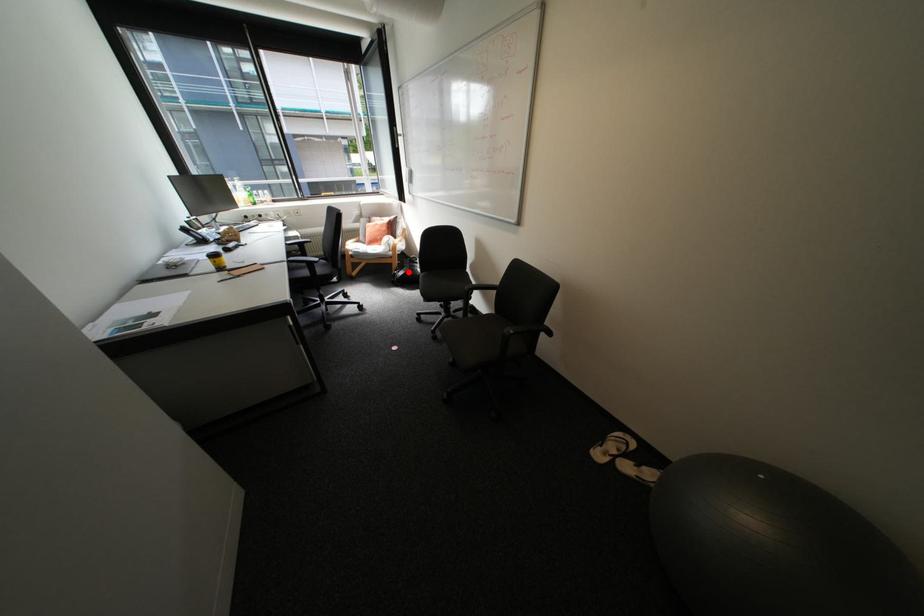
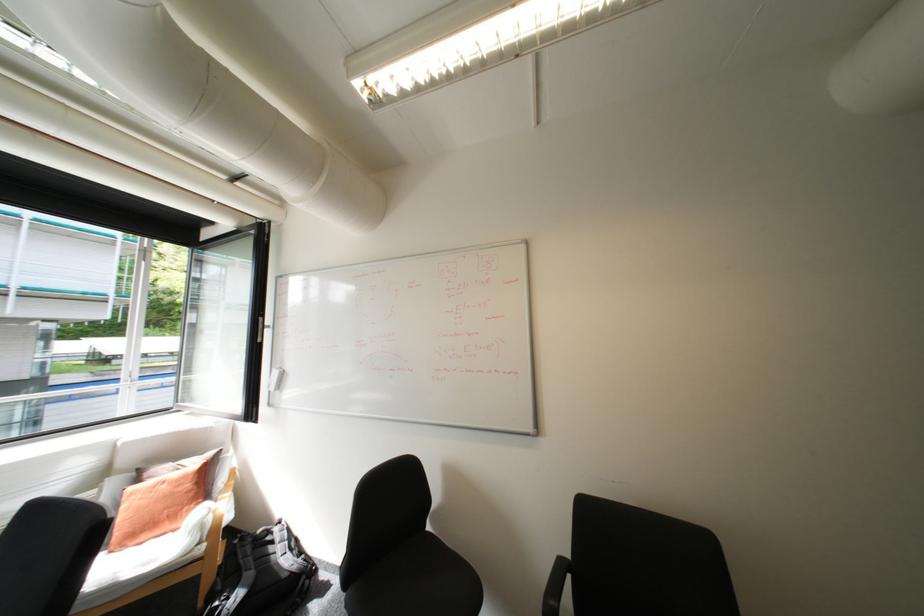
Question: A red point is marked in image1. In image2, is the corresponding 3D point closer to the camera or farther? Reply with the corresponding letter.

Choices:
 (A) The corresponding 3D point is closer.
 (B) The corresponding 3D point is farther.

Answer: (A)